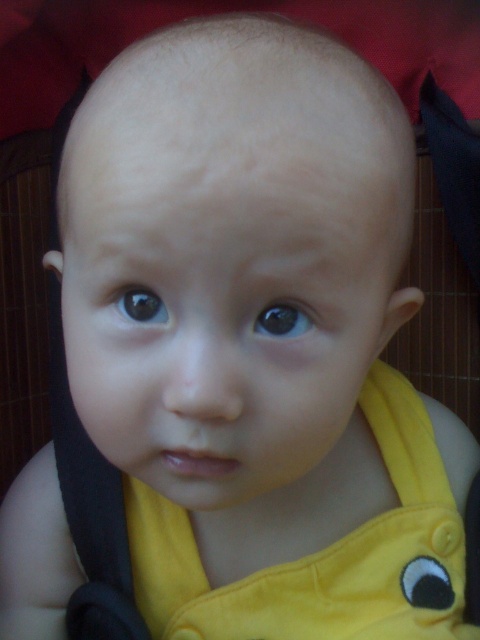
Question: Can you confirm if brown glossy eye at center is smaller than black glossy eye at center?

Choices:
 (A) no
 (B) yes

Answer: (B)

Question: Is brown glossy eye at center wider than black glossy eye at center?

Choices:
 (A) yes
 (B) no

Answer: (A)

Question: Among these points, which one is farthest from the camera?

Choices:
 (A) (152, 316)
 (B) (282, 307)

Answer: (A)

Question: Where is brown glossy eye at center located in relation to black glossy eye at center in the image?

Choices:
 (A) left
 (B) right

Answer: (B)